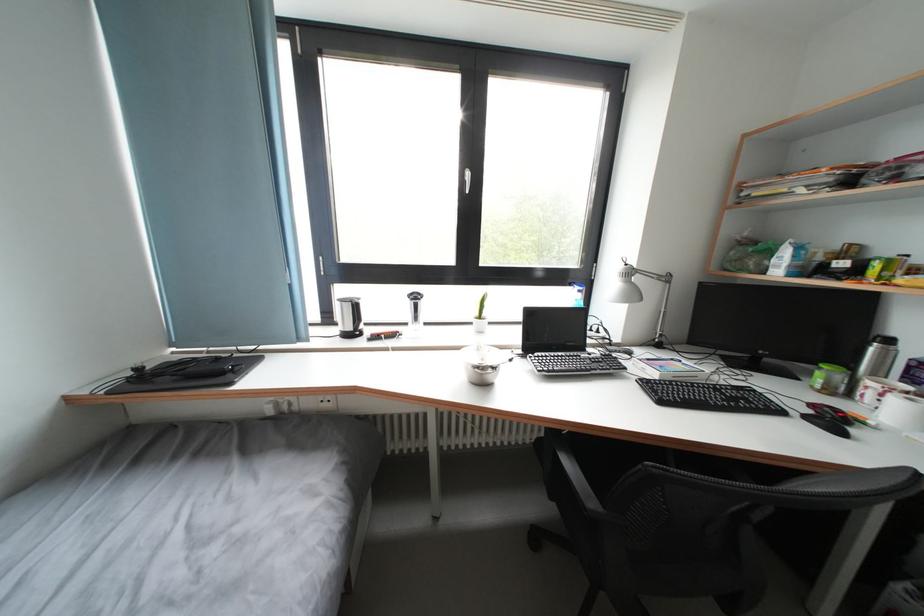
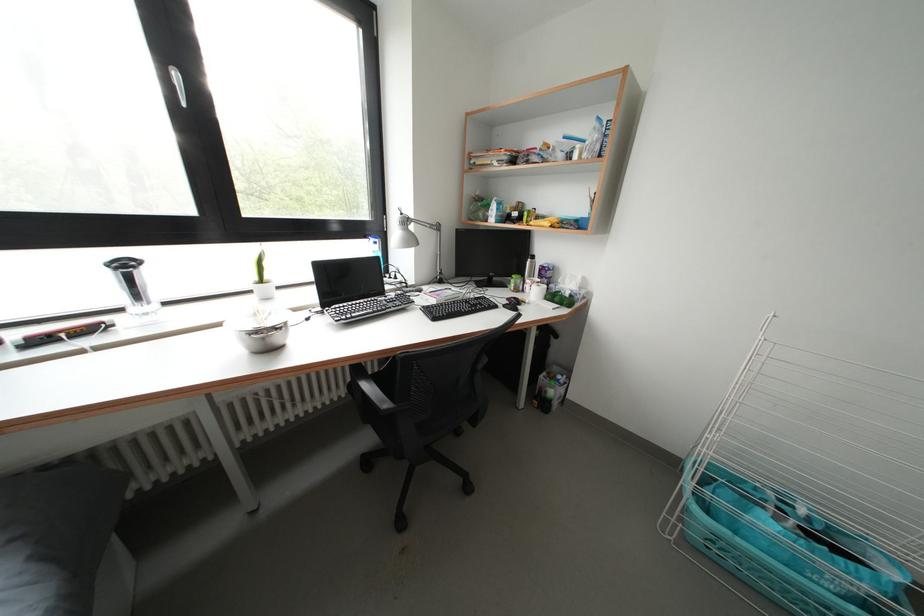
Locate, in the second image, the point that corresponds to (633,270) in the first image.

(408, 219)